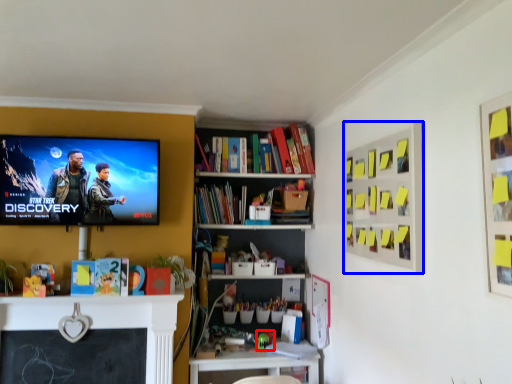
Question: Which point is closer to the camera, toy (highlighted by a red box) or bulletin board (highlighted by a blue box)?

Choices:
 (A) toy
 (B) bulletin board

Answer: (B)